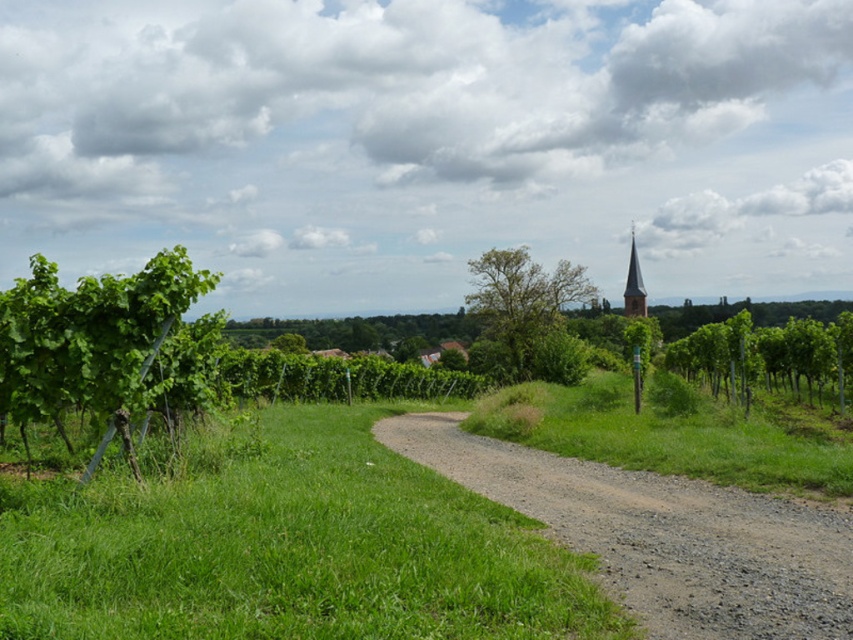
Question: Is green leafy vine at left above green leafy tree at center?

Choices:
 (A) no
 (B) yes

Answer: (A)

Question: Is dusty gravel path at center thinner than green leafy vine at right?

Choices:
 (A) no
 (B) yes

Answer: (B)

Question: Is green leafy vine at right further to camera compared to green leafy tree at center?

Choices:
 (A) no
 (B) yes

Answer: (A)

Question: Which of the following is the closest to the observer?

Choices:
 (A) (669, 573)
 (B) (572, 285)
 (C) (819, 332)
 (D) (643, 298)

Answer: (A)

Question: Which object is positioned farthest from the green leafy vine at right?

Choices:
 (A) green leafy tree at center
 (B) dusty gravel path at center

Answer: (B)

Question: Estimate the real-world distances between objects in this image. Which object is farther from the dusty gravel path at center?

Choices:
 (A) brown wooden spire at upper center
 (B) green leafy vine at right
 (C) green leafy tree at center
 (D) green leafy vine at left

Answer: (A)